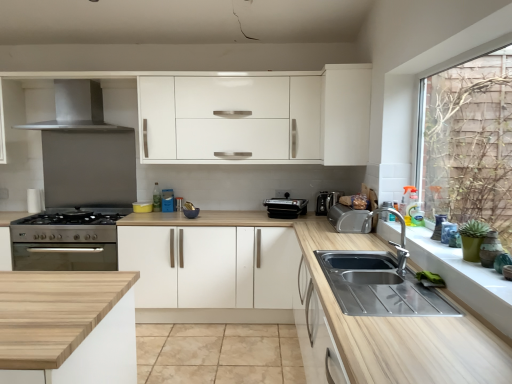
Describe the element at coordinates (218, 354) in the screenshot. Image resolution: width=512 pixels, height=384 pixels. I see `beige tile at center` at that location.

The image size is (512, 384). Find the location of `beige tile at center`. beige tile at center is located at coordinates (218, 354).

What is the approximate width of matte green vase at right, which ranks as the fourth appliance in left-to-right order?

The width of matte green vase at right, which ranks as the fourth appliance in left-to-right order, is 3.34 inches.

The image size is (512, 384). What do you see at coordinates (285, 207) in the screenshot? I see `black plastic toaster at center, the fourth appliance when ordered from front to back` at bounding box center [285, 207].

Where is `white matte cabinet at upper center, which is the 1th cabinetry from right to left`? white matte cabinet at upper center, which is the 1th cabinetry from right to left is located at coordinates (346, 114).

The height and width of the screenshot is (384, 512). What are the coordinates of `wooden at center` in the screenshot? It's located at (377, 318).

Describe the element at coordinates (392, 242) in the screenshot. I see `silver metallic tap at sink right` at that location.

Where is `beige tile at center`? beige tile at center is located at coordinates (218, 354).

From a real-world perspective, between black plastic toaster at center, the fourth appliance when ordered from front to back, and satin silver exhaust hood at upper left, who is vertically lower?

black plastic toaster at center, the fourth appliance when ordered from front to back, is physically lower.

Which object is more forward, black plastic toaster at center, which is the second appliance in left-to-right order, or satin silver exhaust hood at upper left?

satin silver exhaust hood at upper left is more forward.

From the image's perspective, does black plastic toaster at center, which appears as the third appliance when viewed from the right, appear lower than satin silver exhaust hood at upper left?

Yes, from the image's perspective, black plastic toaster at center, which appears as the third appliance when viewed from the right, is beneath satin silver exhaust hood at upper left.

Can you confirm if black plastic toaster at center, the fourth appliance when ordered from front to back, is positioned to the right of satin silver coffee machine at center?

Incorrect, black plastic toaster at center, the fourth appliance when ordered from front to back, is not on the right side of satin silver coffee machine at center.

How many degrees apart are the facing directions of black plastic toaster at center, acting as the 1th appliance starting from the back, and satin silver coffee machine at center?

The angle between the facing direction of black plastic toaster at center, acting as the 1th appliance starting from the back, and the facing direction of satin silver coffee machine at center is 15.8 degrees.

This screenshot has height=384, width=512. I want to click on coffee machine located above the black plastic toaster at center, the fourth appliance when ordered from front to back (from the image's perspective), so click(x=326, y=201).

Which of these two, black plastic toaster at center, which appears as the third appliance when viewed from the right, or satin silver coffee machine at center, is wider?

Wider between the two is black plastic toaster at center, which appears as the third appliance when viewed from the right.

Measure the distance from stainless steel cooker at left, marked as the 3th appliance in a front-to-back arrangement, to beige tile at center.

stainless steel cooker at left, marked as the 3th appliance in a front-to-back arrangement, is 1.11 meters away from beige tile at center.

Based on the photo, between stainless steel cooker at left, the 4th appliance viewed from the right, and beige tile at center, which one has larger size?

With larger size is stainless steel cooker at left, the 4th appliance viewed from the right.

Which point is more distant from viewer, [18,231] or [203,357]?

The point [18,231] is farther.

Considering the positions of objects stainless steel cooker at left, which is the second appliance from back to front, and beige tile at center in the image provided, who is more to the right, stainless steel cooker at left, which is the second appliance from back to front, or beige tile at center?

beige tile at center.

Where is `coffee machine behind the black plastic toaster at center, which appears as the third appliance when viewed from the right`? The width and height of the screenshot is (512, 384). coffee machine behind the black plastic toaster at center, which appears as the third appliance when viewed from the right is located at coordinates (326, 201).

Which is farther from the camera, (326, 210) or (271, 208)?

Point (326, 210)

How different are the orientations of satin silver coffee machine at center and black plastic toaster at center, the fourth appliance when ordered from front to back, in degrees?

15.8 degrees separate the facing orientations of satin silver coffee machine at center and black plastic toaster at center, the fourth appliance when ordered from front to back.

In terms of height, does satin silver coffee machine at center look taller or shorter compared to black plastic toaster at center, the fourth appliance when ordered from front to back?

Considering their sizes, satin silver coffee machine at center has more height than black plastic toaster at center, the fourth appliance when ordered from front to back.

Considering the positions of objects beige tile at center and satin silver toaster at right, which is counted as the 3th appliance, starting from the back, in the image provided, who is more to the left, beige tile at center or satin silver toaster at right, which is counted as the 3th appliance, starting from the back,?

beige tile at center.

At what (x,y) coordinates should I click in order to perform the action: click on the 1st appliance behind the beige tile at center. Please return your answer as a coordinate pair (x, y). The height and width of the screenshot is (384, 512). Looking at the image, I should click on (349, 219).

Could you tell me if beige tile at center is turned towards satin silver toaster at right, which is counted as the 3th appliance, starting from the back?

No.

How many degrees apart are the facing directions of black plastic toaster at center, acting as the 1th appliance starting from the back, and silver metallic tap at sink right?

73.4 degrees.

Can silver metallic tap at sink right be found inside black plastic toaster at center, the fourth appliance when ordered from front to back?

Definitely not — silver metallic tap at sink right is not inside black plastic toaster at center, the fourth appliance when ordered from front to back.

From the image's perspective, is black plastic toaster at center, the fourth appliance when ordered from front to back, above or below silver metallic tap at sink right?

black plastic toaster at center, the fourth appliance when ordered from front to back, is situated higher than silver metallic tap at sink right in the image.

From a real-world perspective, is black plastic toaster at center, acting as the 1th appliance starting from the back, located higher than silver metallic tap at sink right?

No, from a real-world perspective, black plastic toaster at center, acting as the 1th appliance starting from the back, is not over silver metallic tap at sink right

Who is smaller, matte green vase at right, the fourth appliance viewed from the back, or silver metallic tap at sink right?

matte green vase at right, the fourth appliance viewed from the back.

The height and width of the screenshot is (384, 512). Find the location of `tap on the left of matte green vase at right, which ranks as the fourth appliance in left-to-right order`. tap on the left of matte green vase at right, which ranks as the fourth appliance in left-to-right order is located at coordinates (392, 242).

Can you tell me how much matte green vase at right, acting as the first appliance starting from the front, and silver metallic tap at sink right differ in facing direction?

0.000315 degrees separate the facing orientations of matte green vase at right, acting as the first appliance starting from the front, and silver metallic tap at sink right.

Is there a large distance between matte green vase at right, arranged as the first appliance when viewed from the right, and silver metallic tap at sink right?

That's not correct — matte green vase at right, arranged as the first appliance when viewed from the right, is a little close to silver metallic tap at sink right.

Identify the location of the 1st appliance below the satin silver exhaust hood at upper left (from the image's perspective). Image resolution: width=512 pixels, height=384 pixels. (285, 207).

Where is `coffee machine positioned vertically above the black plastic toaster at center, which appears as the third appliance when viewed from the right (from a real-world perspective)`? This screenshot has height=384, width=512. coffee machine positioned vertically above the black plastic toaster at center, which appears as the third appliance when viewed from the right (from a real-world perspective) is located at coordinates (326, 201).

Considering their positions, is white matte cabinet at upper center, which is the 1th cabinetry from right to left, positioned closer to satin silver coffee machine at center than satin silver toaster at right, positioned as the 3th appliance in left-to-right order?

Based on the image, satin silver toaster at right, positioned as the 3th appliance in left-to-right order, appears to be nearer to satin silver coffee machine at center.

Which object lies nearer to the anchor point satin silver coffee machine at center, wooden at center or black plastic toaster at center, the fourth appliance when ordered from front to back?

Among the two, black plastic toaster at center, the fourth appliance when ordered from front to back, is located nearer to satin silver coffee machine at center.

Looking at the image, which one is located further to white matte cabinet at upper center, positioned as the 2th cabinetry in left-to-right order, black plastic toaster at center, which is the second appliance in left-to-right order, or stainless steel cooker at left, marked as the 3th appliance in a front-to-back arrangement?

stainless steel cooker at left, marked as the 3th appliance in a front-to-back arrangement, is positioned further to the anchor white matte cabinet at upper center, positioned as the 2th cabinetry in left-to-right order.

Estimate the real-world distances between objects in this image. Which object is further from silver metallic tap at sink right, white matte cabinet at center, which is the 1th cabinetry in bottom-to-top order, or white glossy window sill at lower right?

white matte cabinet at center, which is the 1th cabinetry in bottom-to-top order, lies further to silver metallic tap at sink right than the other object.

When comparing their distances from black plastic toaster at center, acting as the 1th appliance starting from the back, does white matte cabinet at center, which is the 1th cabinetry in bottom-to-top order, or silver metallic tap at sink right seem further?

silver metallic tap at sink right is further to black plastic toaster at center, acting as the 1th appliance starting from the back.

Which object lies nearer to the anchor point matte green vase at right, arranged as the first appliance when viewed from the right, white glossy window sill at lower right or silver metallic tap at sink right?

white glossy window sill at lower right is closer to matte green vase at right, arranged as the first appliance when viewed from the right.

In the scene shown: From the image, which object appears to be nearer to satin silver exhaust hood at upper left, satin silver toaster at right, arranged as the second appliance when viewed from the right, or black plastic toaster at center, acting as the 1th appliance starting from the back?

Among the two, black plastic toaster at center, acting as the 1th appliance starting from the back, is located nearer to satin silver exhaust hood at upper left.

From the image, which object appears to be nearer to silver metallic tap at sink right, stainless steel cooker at left, marked as the first appliance in a left-to-right arrangement, or matte green vase at right, arranged as the first appliance when viewed from the right?

matte green vase at right, arranged as the first appliance when viewed from the right.

At what (x,y) coordinates should I click in order to perform the action: click on cabinetry between wooden at center and white matte cabinet at center, the second cabinetry viewed from the top, along the z-axis. Please return your answer as a coordinate pair (x, y). The image size is (512, 384). Looking at the image, I should click on (346, 114).

Locate an element on the screen. This screenshot has height=384, width=512. coffee machine that lies between white matte cabinet at upper center, marked as the 2th cabinetry in a bottom-to-top arrangement, and white matte cabinet at center, which is counted as the 1th cabinetry, starting from the left, from top to bottom is located at coordinates (326, 201).

This screenshot has height=384, width=512. Find the location of `appliance situated between white matte cabinet at center, marked as the second cabinetry in a right-to-left arrangement, and satin silver coffee machine at center from left to right`. appliance situated between white matte cabinet at center, marked as the second cabinetry in a right-to-left arrangement, and satin silver coffee machine at center from left to right is located at coordinates (285, 207).

Locate an element on the screen. tile between matte green vase at right, which ranks as the fourth appliance in left-to-right order, and satin silver coffee machine at center from front to back is located at coordinates (218, 354).